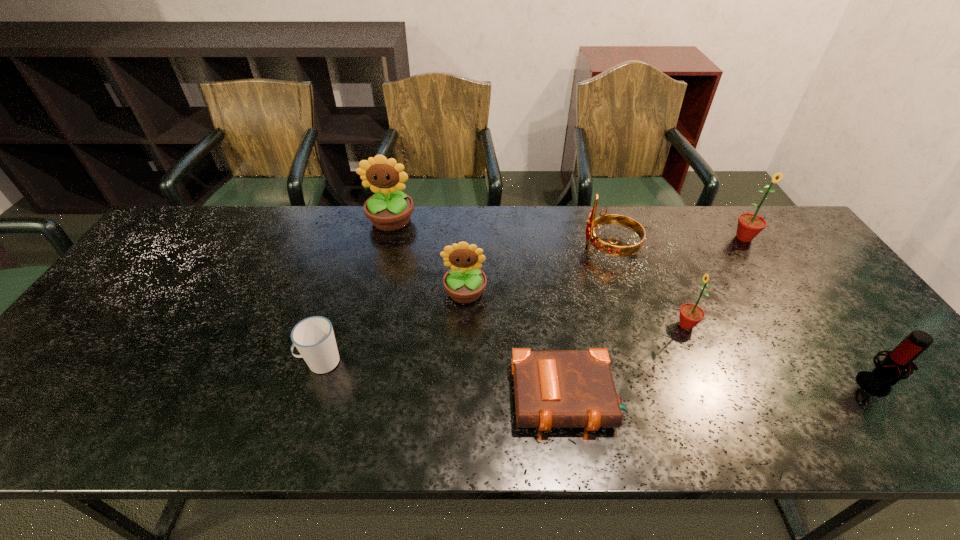
Where is `vacant area that lies between the Bible and the bigger yellow sunflower`? The height and width of the screenshot is (540, 960). vacant area that lies between the Bible and the bigger yellow sunflower is located at coordinates (479, 309).

Locate an element on the screen. free point between the farther yellow sunflower and the fifth farthest object is located at coordinates (539, 273).

Where is `vacant space in between the red microphone and the third farthest sunflower`? The width and height of the screenshot is (960, 540). vacant space in between the red microphone and the third farthest sunflower is located at coordinates (670, 338).

Identify the location of free area in between the bigger yellow sunflower and the second shortest object. This screenshot has height=540, width=960. coord(356,292).

In order to click on object that is the second closest to the smaller green sunflower in this screenshot , I will do `click(553, 388)`.

At what (x,y) coordinates should I click in order to perform the action: click on object that stands as the closest to the fifth farthest object. Please return your answer as a coordinate pair (x, y). This screenshot has width=960, height=540. Looking at the image, I should click on (610, 248).

Choose which sunflower is the third nearest neighbor to the rightmost sunflower. Please provide its 2D coordinates. Your answer should be formatted as a tuple, i.e. [(x, y)], where the tuple contains the x and y coordinates of a point satisfying the conditions above.

[(389, 209)]

The image size is (960, 540). I want to click on sunflower that can be found as the third closest to the rightmost sunflower, so click(389, 209).

Locate an element on the screen. The image size is (960, 540). vacant position in the image that satisfies the following two spatial constraints: 1. on the face of the nearer green sunflower; 2. on the spine side of the Bible is located at coordinates (717, 397).

You are a GUI agent. You are given a task and a screenshot of the screen. Output one action in this format:
    pyautogui.click(x=<x>, y=<y>)
    Task: Click on the free spot that satisfies the following two spatial constraints: 1. on the face of the leftmost sunflower; 2. on the left side of the red microphone
    The height and width of the screenshot is (540, 960).
    Given the screenshot: What is the action you would take?
    pyautogui.click(x=351, y=384)